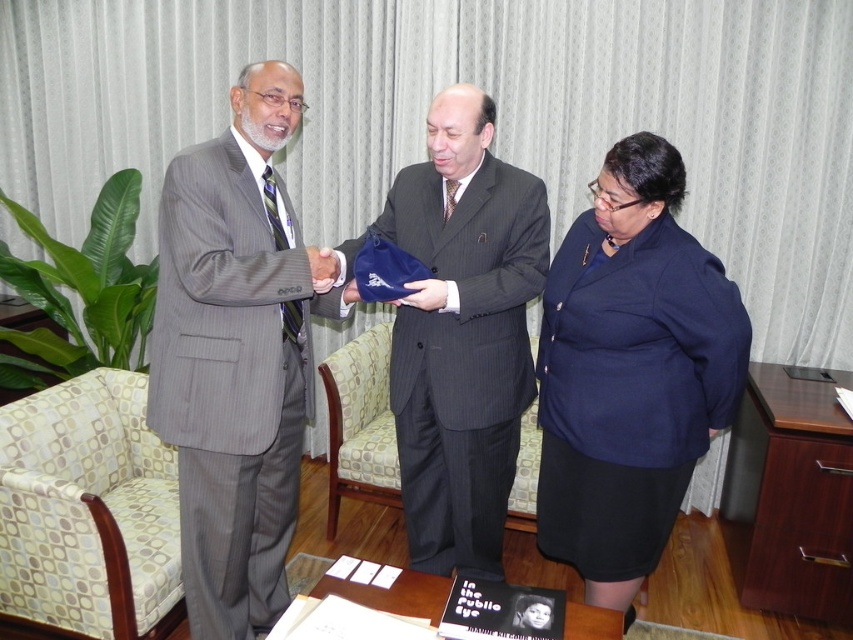
You are a photographer setting up a shoot in this room. You need to position a large light source behind the patterned fabric armchair at left and the gray pinstripe armchair at center. Which chair should the light be placed behind to ensure it illuminates both chairs equally?

The light should be placed behind the gray pinstripe armchair at center because the patterned fabric armchair at left is in front of it, so placing the light behind the back chair will allow it to illuminate both chairs equally.